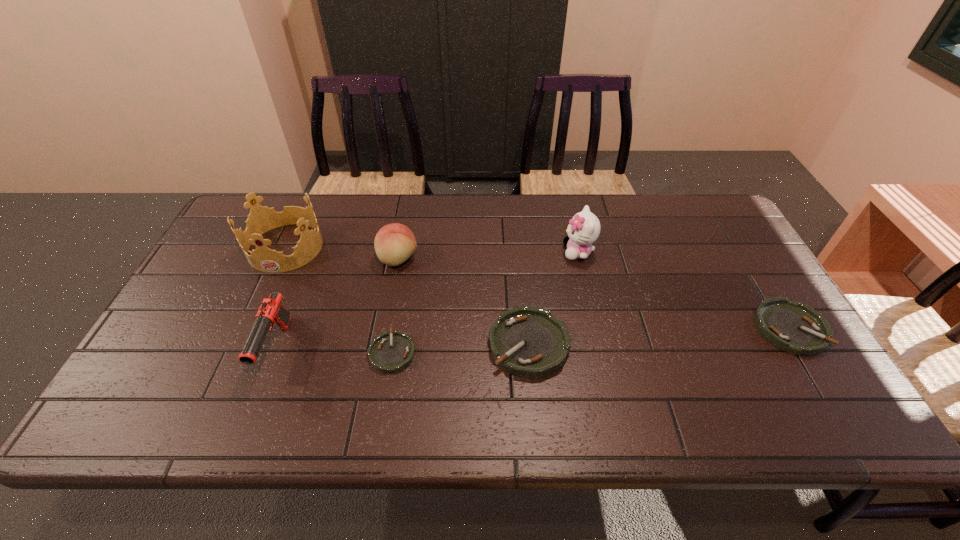
The height and width of the screenshot is (540, 960). I want to click on object that is at the left edge, so click(x=261, y=219).

Locate an element on the screen. The width and height of the screenshot is (960, 540). object present at the right edge is located at coordinates (795, 327).

Where is `object at the far left corner`? The image size is (960, 540). object at the far left corner is located at coordinates (261, 219).

Identify the location of free space at the far edge. coord(366,207).

The image size is (960, 540). Find the location of `free space at the near edge of the desktop`. free space at the near edge of the desktop is located at coordinates (236, 374).

In the image, there is a desktop. Find the location of `vacant space at the left edge`. vacant space at the left edge is located at coordinates (243, 276).

In the image, there is a desktop. At what (x,y) coordinates should I click in order to perform the action: click on free space at the right edge. Please return your answer as a coordinate pair (x, y). The height and width of the screenshot is (540, 960). Looking at the image, I should click on (741, 250).

You are a GUI agent. You are given a task and a screenshot of the screen. Output one action in this format:
    pyautogui.click(x=<x>, y=<y>)
    Task: Click on the free space at the far right corner
    This screenshot has height=540, width=960.
    Given the screenshot: What is the action you would take?
    pyautogui.click(x=703, y=240)

Where is `free spot at the near right corner of the desktop`? The width and height of the screenshot is (960, 540). free spot at the near right corner of the desktop is located at coordinates (815, 384).

You are a GUI agent. You are given a task and a screenshot of the screen. Output one action in this format:
    pyautogui.click(x=<x>, y=<y>)
    Task: Click on the vacant region between the rightmost object and the second ashtray from right to left
    This screenshot has width=960, height=540.
    Given the screenshot: What is the action you would take?
    pyautogui.click(x=659, y=336)